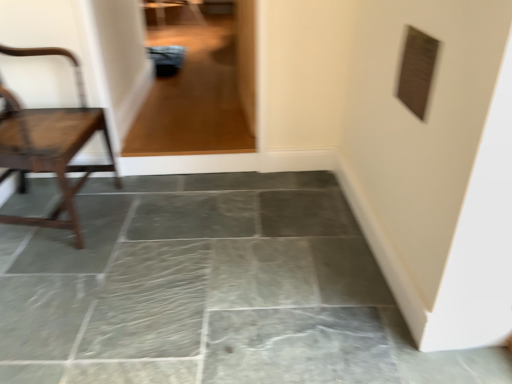
Question: Is transparent glass door at upper center bigger or smaller than gray stone floor at center?

Choices:
 (A) small
 (B) big

Answer: (A)

Question: In the image, is transparent glass door at upper center positioned in front of or behind gray stone floor at center?

Choices:
 (A) front
 (B) behind

Answer: (B)

Question: Estimate the real-world distances between objects in this image. Which object is farther from the gray stone floor at center?

Choices:
 (A) wooden chair at left
 (B) transparent glass door at upper center

Answer: (B)

Question: Considering the real-world distances, which object is closest to the gray stone floor at center?

Choices:
 (A) transparent glass door at upper center
 (B) wooden chair at left

Answer: (B)